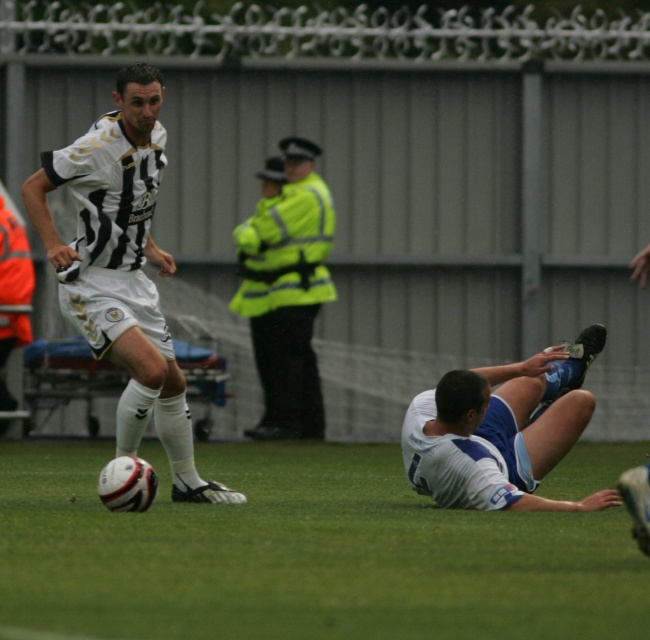
Question: Among these points, which one is nearest to the camera?

Choices:
 (A) pos(315,204)
 (B) pos(436,436)
 (C) pos(148,84)

Answer: (B)

Question: Can you confirm if white striped jersey at center is bigger than high visibility jacket at center?

Choices:
 (A) yes
 (B) no

Answer: (A)

Question: Does white matte jersey at lower right have a greater width compared to high visibility jacket at center?

Choices:
 (A) yes
 (B) no

Answer: (A)

Question: Which is farther from the high visibility jacket at center?

Choices:
 (A) white striped jersey at center
 (B) white matte jersey at lower right

Answer: (B)

Question: Based on their relative distances, which object is nearer to the high visibility jacket at center?

Choices:
 (A) white matte jersey at lower right
 (B) white striped jersey at center

Answer: (B)

Question: Does white striped jersey at center appear on the right side of high visibility jacket at center?

Choices:
 (A) no
 (B) yes

Answer: (A)